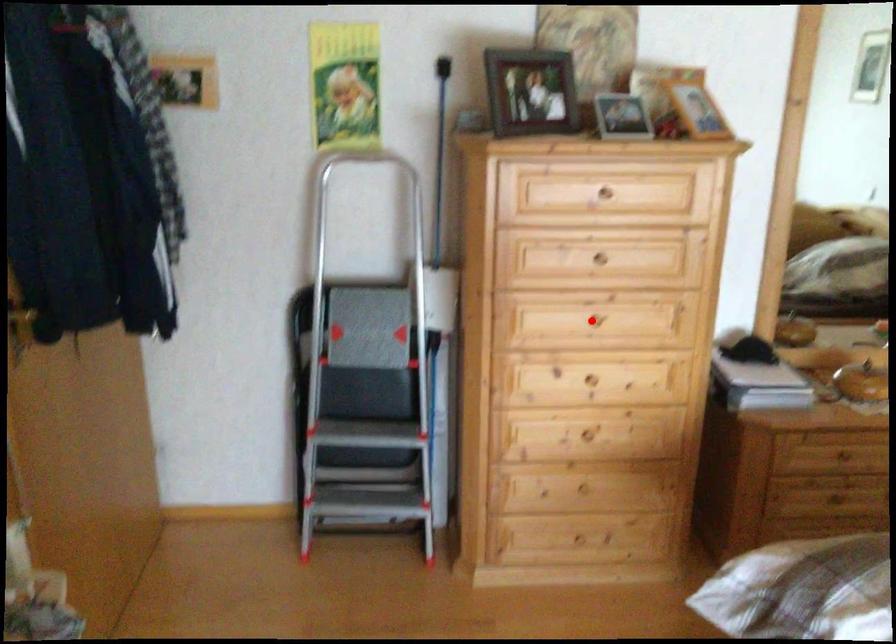
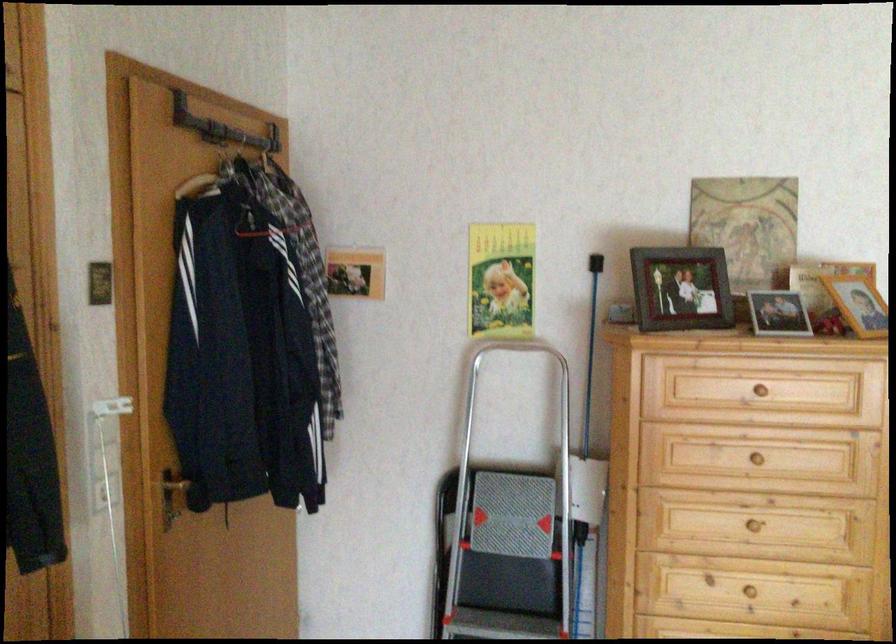
The point at the highlighted location is marked in the first image. Where is the corresponding point in the second image?

(754, 526)